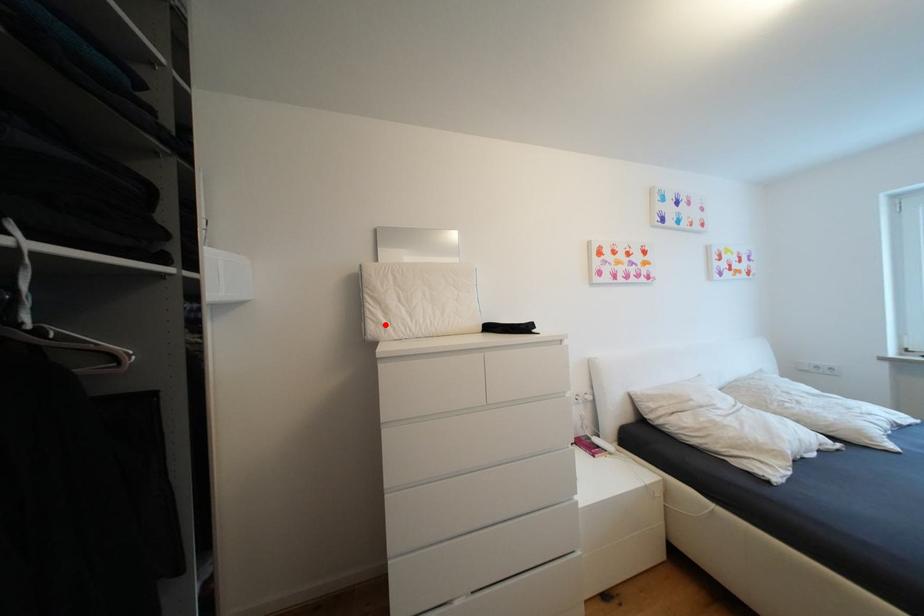
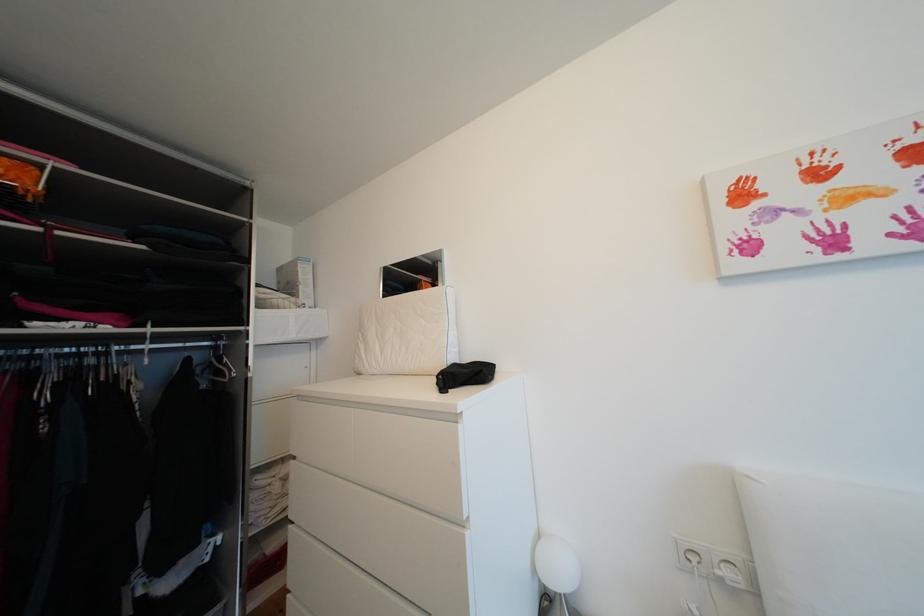
In the second image, find the point that corresponds to the highlighted location in the first image.

(368, 359)